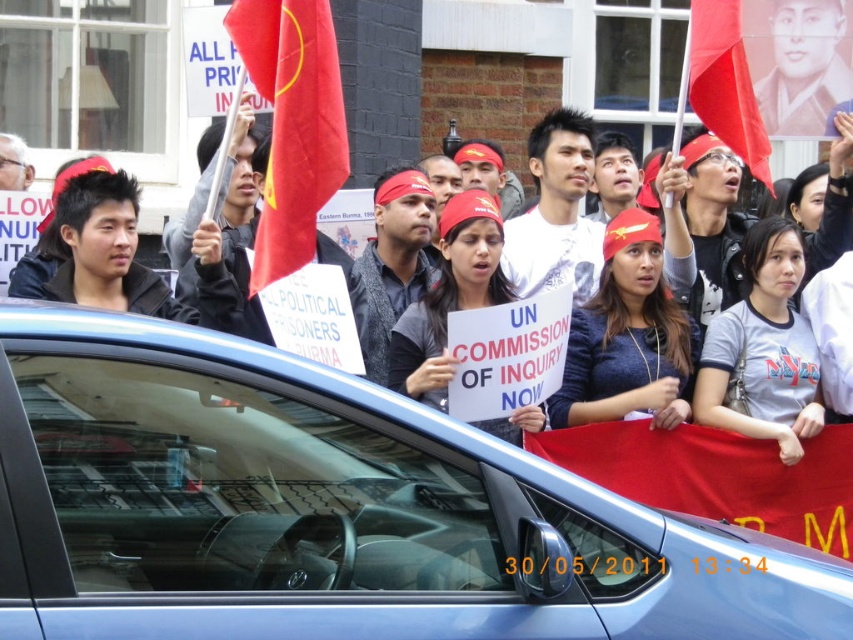
You are a photographer at the protest scene. You want to take a photo that includes both the matte red headband at center and the matte red flag at upper right. Considering their sizes, which object will appear bigger in the photo?

The matte red headband at center will appear bigger in the photo because it has a larger size compared to the matte red flag at upper right.

You are a photographer standing in the crowd at the protest. You want to take a photo of both the sign reading UN COMMISSION OF INQUIRY NOW and the sign reading POLITICAL PRISONERS BURMA. The two signs are located at the positions corresponding to point (663,320) and point (735,48). Which sign is closer to you so that you can focus on it first?

Point (663,320) is further to the viewer than point (735,48). Therefore, the sign at point (735,48) is closer to you and should be focused on first.